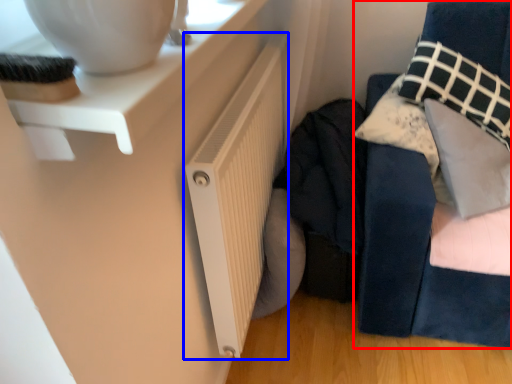
Question: Which point is closer to the camera, furniture (highlighted by a red box) or radiator (highlighted by a blue box)?

Choices:
 (A) furniture
 (B) radiator

Answer: (B)